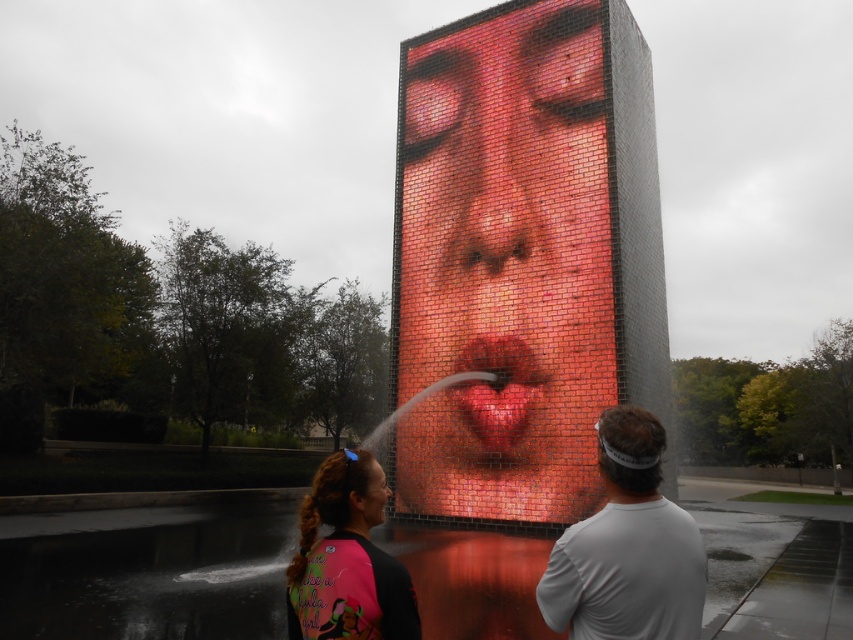
Does brick mosaic face at center have a larger size compared to matte red brick nose at center?

No.

Identify the location of brick mosaic face at center. This screenshot has width=853, height=640. (503, 262).

I want to click on brick mosaic face at center, so click(503, 262).

You are a GUI agent. You are given a task and a screenshot of the screen. Output one action in this format:
    pyautogui.click(x=<x>, y=<y>)
    Task: Click on the brick mosaic face at center
    The width and height of the screenshot is (853, 640).
    Given the screenshot: What is the action you would take?
    pyautogui.click(x=503, y=262)

Does white matte shirt at center appear over matte plastic face at center?

No, white matte shirt at center is not above matte plastic face at center.

Who is lower down, white matte shirt at center or matte plastic face at center?

white matte shirt at center is lower down.

Identify the location of white matte shirt at center. This screenshot has width=853, height=640. (627, 547).

Where is `white matte shirt at center`? white matte shirt at center is located at coordinates (627, 547).

What do you see at coordinates (627, 547) in the screenshot? I see `white matte shirt at center` at bounding box center [627, 547].

Find the location of a particular element. white matte shirt at center is located at coordinates (627, 547).